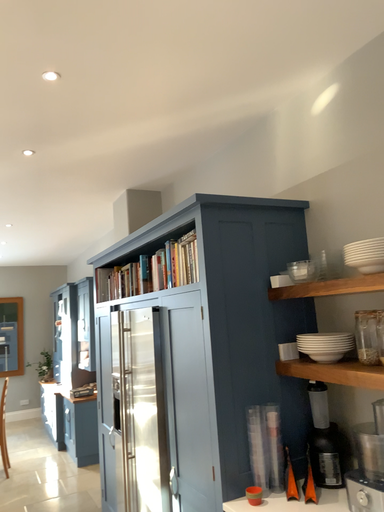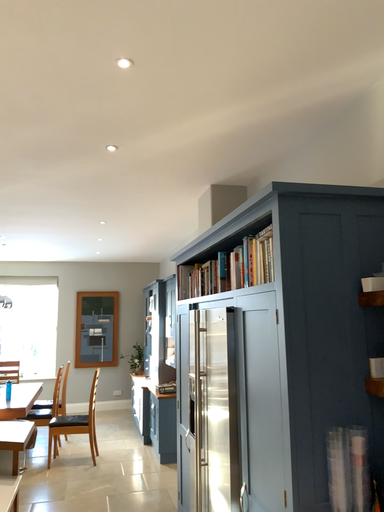
Question: Which way did the camera rotate in the video?

Choices:
 (A) rotated left
 (B) rotated right

Answer: (A)